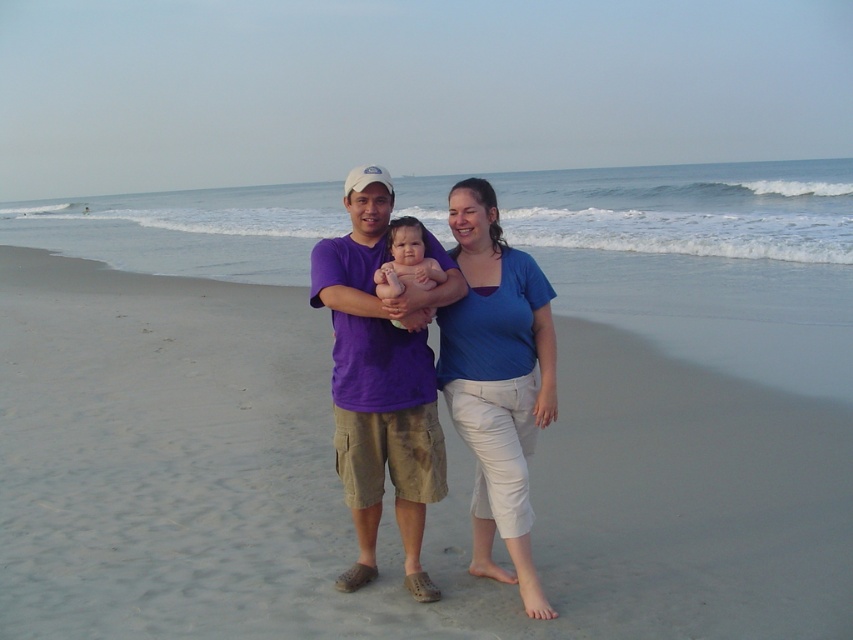
You are standing at the point marked by coordinates point (357,429) and want to take a photo of the scene. However, you need to ensure that the point marked by coordinates point (502,369) is not in the foreground of your photo. Is this possible?

Since point (357,429) is behind point (502,369), positioning yourself at point (357,429) would naturally place point (502,369) in the foreground. Therefore, it is not possible to take a photo from this position without having point (502,369) in the foreground.